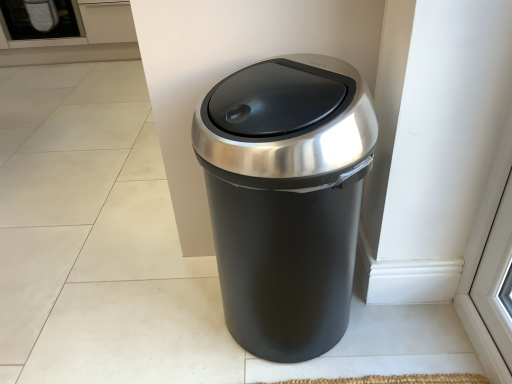
Locate an element on the screen. vacant area situated to the left side of black matte trash can at center is located at coordinates (164, 311).